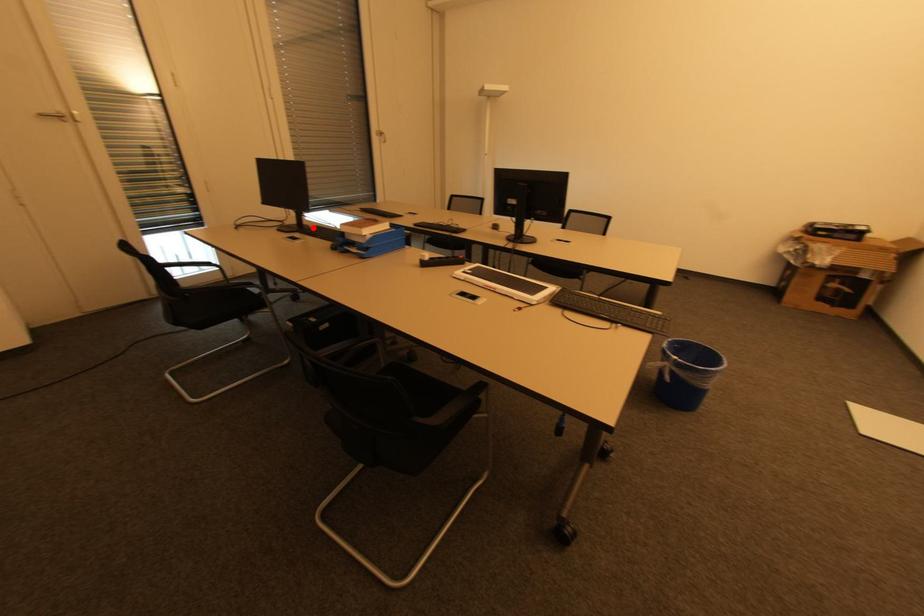
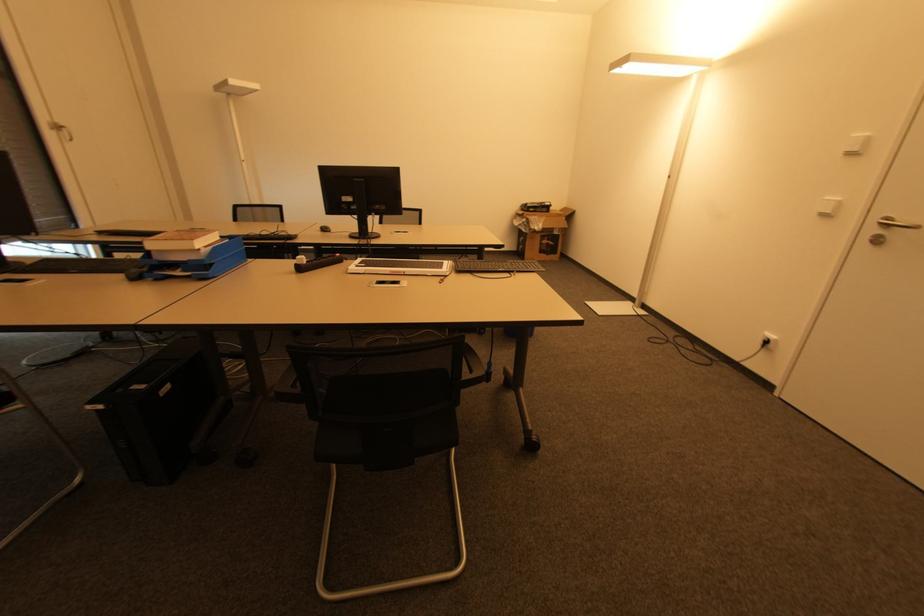
In the second image, find the point that corresponds to the highlighted location in the first image.

(30, 264)